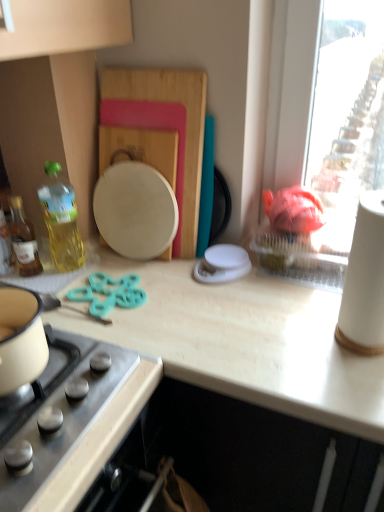
Question: From a real-world perspective, is translucent yellow bottle at left, acting as the 1th bottle starting from the left, located higher than light wood countertop at center?

Choices:
 (A) yes
 (B) no

Answer: (A)

Question: From the image's perspective, is translucent yellow bottle at left, the 2th bottle positioned from the right, on light wood countertop at center?

Choices:
 (A) yes
 (B) no

Answer: (A)

Question: Is translucent yellow bottle at left, the 2th bottle positioned from the right, with light wood countertop at center?

Choices:
 (A) no
 (B) yes

Answer: (A)

Question: Could you tell me if translucent yellow bottle at left, the 2th bottle positioned from the right, is turned towards light wood countertop at center?

Choices:
 (A) yes
 (B) no

Answer: (B)

Question: Is the position of translucent yellow bottle at left, acting as the 1th bottle starting from the left, more distant than that of light wood countertop at center?

Choices:
 (A) no
 (B) yes

Answer: (B)

Question: Does point (243, 296) appear closer or farther from the camera than point (339, 324)?

Choices:
 (A) farther
 (B) closer

Answer: (A)

Question: From the image's perspective, is light wood countertop at center located above or below white paper towel at right?

Choices:
 (A) above
 (B) below

Answer: (B)

Question: Would you say light wood countertop at center is inside or outside white paper towel at right?

Choices:
 (A) outside
 (B) inside

Answer: (A)

Question: Looking at the image, does light wood countertop at center seem bigger or smaller compared to white paper towel at right?

Choices:
 (A) big
 (B) small

Answer: (A)

Question: From the image's perspective, is translucent yellow bottle at left, acting as the 1th bottle starting from the left, positioned above or below stainless steel gas stove at lower left?

Choices:
 (A) above
 (B) below

Answer: (A)

Question: From a real-world perspective, relative to stainless steel gas stove at lower left, is translucent yellow bottle at left, acting as the 1th bottle starting from the left, vertically above or below?

Choices:
 (A) above
 (B) below

Answer: (A)

Question: Is translucent yellow bottle at left, the 2th bottle positioned from the right, bigger or smaller than stainless steel gas stove at lower left?

Choices:
 (A) small
 (B) big

Answer: (A)

Question: From their relative heights in the image, would you say translucent yellow bottle at left, acting as the 1th bottle starting from the left, is taller or shorter than stainless steel gas stove at lower left?

Choices:
 (A) tall
 (B) short

Answer: (B)

Question: Looking at the image, does teal plastic scissors at center seem bigger or smaller compared to translucent yellow bottle at left, acting as the 1th bottle starting from the left?

Choices:
 (A) big
 (B) small

Answer: (B)

Question: From their relative heights in the image, would you say teal plastic scissors at center is taller or shorter than translucent yellow bottle at left, acting as the 1th bottle starting from the left?

Choices:
 (A) short
 (B) tall

Answer: (A)